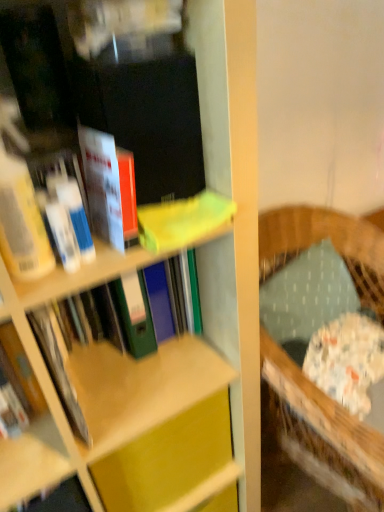
Locate an element on the screen. matte plastic book at upper left, the 1th book from the front is located at coordinates (109, 188).

Could you measure the distance between matte plastic book at upper left, arranged as the third book when viewed from the back, and textured green pillow at right?

26.74 inches.

Looking at their sizes, would you say matte plastic book at upper left, the 1th book from the front, is wider or thinner than textured green pillow at right?

In the image, matte plastic book at upper left, the 1th book from the front, appears to be more narrow than textured green pillow at right.

Where is `pillow that appears below the matte plastic book at upper left, the 1th book from the front (from a real-world perspective)`? This screenshot has width=384, height=512. pillow that appears below the matte plastic book at upper left, the 1th book from the front (from a real-world perspective) is located at coordinates tap(306, 295).

From the image's perspective, is matte plastic book at upper left, arranged as the third book when viewed from the back, over textured green pillow at right?

Yes.

Considering the sizes of wooden rocking chair at right and matte green folder at center, positioned as the 1th book in back-to-front order, in the image, is wooden rocking chair at right bigger or smaller than matte green folder at center, positioned as the 1th book in back-to-front order,?

wooden rocking chair at right is bigger than matte green folder at center, positioned as the 1th book in back-to-front order.

Find the location of a particular element. The image size is (384, 512). book behind the wooden rocking chair at right is located at coordinates (109, 318).

Between wooden rocking chair at right and matte green folder at center, positioned as the 1th book in back-to-front order, which one is positioned in front?

wooden rocking chair at right is more forward.

From a real-world perspective, is wooden rocking chair at right physically below matte green folder at center, positioned as the 1th book in back-to-front order?

Yes, from a real-world perspective, wooden rocking chair at right is beneath matte green folder at center, positioned as the 1th book in back-to-front order.

Is matte yellow cabinet at center to the left of textured green pillow at right from the viewer's perspective?

Correct, you'll find matte yellow cabinet at center to the left of textured green pillow at right.

Is matte yellow cabinet at center aimed at textured green pillow at right?

No, matte yellow cabinet at center is not facing towards textured green pillow at right.

Considering the sizes of objects matte yellow cabinet at center and textured green pillow at right in the image provided, who is wider, matte yellow cabinet at center or textured green pillow at right?

Wider between the two is textured green pillow at right.

Who is smaller, matte yellow cabinet at center or textured green pillow at right?

matte yellow cabinet at center is smaller.

Looking at this image, are matte yellow cabinet at center and matte green folder at center, the third book viewed from the front, beside each other?

matte yellow cabinet at center is not next to matte green folder at center, the third book viewed from the front, and they're not touching.

Does matte yellow cabinet at center have a lesser height compared to matte green folder at center, the third book viewed from the front?

In fact, matte yellow cabinet at center may be taller than matte green folder at center, the third book viewed from the front.

Does matte yellow cabinet at center lie behind matte green folder at center, the third book viewed from the front?

That is True.

From a real-world perspective, is matte yellow cabinet at center located higher than matte green folder at center, the third book viewed from the front?

Incorrect, from a real-world perspective, matte yellow cabinet at center is lower than matte green folder at center, the third book viewed from the front.

Could you tell me if matte yellow book at upper center, the second book positioned from the front, is facing textured green pillow at right?

No, matte yellow book at upper center, the second book positioned from the front, is not facing towards textured green pillow at right.

From a real-world perspective, is matte yellow book at upper center, which is counted as the second book, starting from the back, physically above textured green pillow at right?

Indeed, from a real-world perspective, matte yellow book at upper center, which is counted as the second book, starting from the back, stands above textured green pillow at right.

Based on the photo, between matte yellow book at upper center, which is counted as the second book, starting from the back, and textured green pillow at right, which one has more height?

Standing taller between the two is textured green pillow at right.

Is the surface of matte yellow book at upper center, the second book positioned from the front, in direct contact with textured green pillow at right?

No, matte yellow book at upper center, the second book positioned from the front, is not beside textured green pillow at right.

From the image's perspective, is matte plastic book at upper left, the 1th book from the front, above or below matte yellow cabinet at center?

Clearly, from the image's perspective, matte plastic book at upper left, the 1th book from the front, is above matte yellow cabinet at center.

Looking at their sizes, would you say matte plastic book at upper left, the 1th book from the front, is wider or thinner than matte yellow cabinet at center?

matte plastic book at upper left, the 1th book from the front, is wider than matte yellow cabinet at center.

Is matte plastic book at upper left, the 1th book from the front, oriented towards matte yellow cabinet at center?

No, matte plastic book at upper left, the 1th book from the front, is not aimed at matte yellow cabinet at center.

Is matte plastic book at upper left, arranged as the third book when viewed from the back, next to matte yellow cabinet at center?

No, matte plastic book at upper left, arranged as the third book when viewed from the back, is not touching matte yellow cabinet at center.

Consider the image. From the image's perspective, is textured green pillow at right positioned above or below matte plastic book at upper left, the 1th book from the front?

Clearly, from the image's perspective, textured green pillow at right is below matte plastic book at upper left, the 1th book from the front.

Is point (269, 278) less distant than point (128, 189)?

No.

Is textured green pillow at right aimed at matte plastic book at upper left, the 1th book from the front?

No, textured green pillow at right is not oriented towards matte plastic book at upper left, the 1th book from the front.

Is textured green pillow at right spatially inside matte plastic book at upper left, the 1th book from the front, or outside of it?

textured green pillow at right lies outside matte plastic book at upper left, the 1th book from the front.

Locate an element on the screen. pillow below the matte plastic book at upper left, arranged as the third book when viewed from the back (from the image's perspective) is located at coordinates (306, 295).

At what (x,y) coordinates should I click in order to perform the action: click on rocking chair that is on the right side of matte green folder at center, positioned as the 1th book in back-to-front order. Please return your answer as a coordinate pair (x, y). The width and height of the screenshot is (384, 512). Looking at the image, I should click on (322, 432).

Based on the photo, based on their spatial positions, is matte yellow cabinet at center or matte plastic book at upper left, arranged as the third book when viewed from the back, closer to wooden rocking chair at right?

matte yellow cabinet at center lies closer to wooden rocking chair at right than the other object.

Considering their positions, is wooden rocking chair at right positioned further to matte yellow book at upper center, which is counted as the second book, starting from the back, than matte plastic book at upper left, the 1th book from the front?

wooden rocking chair at right lies further to matte yellow book at upper center, which is counted as the second book, starting from the back, than the other object.

When comparing their distances from matte yellow cabinet at center, does matte green folder at center, positioned as the 1th book in back-to-front order, or textured green pillow at right seem further?

textured green pillow at right lies further to matte yellow cabinet at center than the other object.

When comparing their distances from textured green pillow at right, does matte plastic book at upper left, arranged as the third book when viewed from the back, or matte yellow book at upper center, which is counted as the second book, starting from the back, seem further?

Based on the image, matte plastic book at upper left, arranged as the third book when viewed from the back, appears to be further to textured green pillow at right.

When comparing their distances from matte yellow cabinet at center, does wooden rocking chair at right or textured green pillow at right seem further?

textured green pillow at right.

Considering their positions, is matte yellow book at upper center, the second book positioned from the front, positioned closer to wooden rocking chair at right than matte yellow cabinet at center?

Among the two, matte yellow cabinet at center is located nearer to wooden rocking chair at right.

Looking at the image, which one is located closer to matte yellow book at upper center, the second book positioned from the front, matte plastic book at upper left, arranged as the third book when viewed from the back, or matte green folder at center, positioned as the 1th book in back-to-front order?

Among the two, matte plastic book at upper left, arranged as the third book when viewed from the back, is located nearer to matte yellow book at upper center, the second book positioned from the front.

Based on their spatial positions, is matte yellow cabinet at center or matte yellow book at upper center, the second book positioned from the front, further from matte green folder at center, positioned as the 1th book in back-to-front order?

Among the two, matte yellow book at upper center, the second book positioned from the front, is located further to matte green folder at center, positioned as the 1th book in back-to-front order.

In order to click on pillow between matte yellow cabinet at center and wooden rocking chair at right from left to right in this screenshot , I will do `click(306, 295)`.

Find the location of a particular element. The image size is (384, 512). cabinet situated between matte green folder at center, positioned as the 1th book in back-to-front order, and wooden rocking chair at right from left to right is located at coordinates (167, 459).

Find the location of a particular element. Image resolution: width=384 pixels, height=512 pixels. pillow between matte green folder at center, positioned as the 1th book in back-to-front order, and wooden rocking chair at right is located at coordinates (306, 295).

The height and width of the screenshot is (512, 384). Find the location of `rocking chair between matte yellow book at upper center, the second book positioned from the front, and textured green pillow at right from front to back`. rocking chair between matte yellow book at upper center, the second book positioned from the front, and textured green pillow at right from front to back is located at coordinates (322, 432).